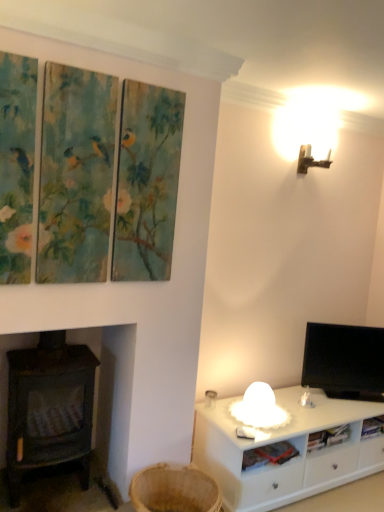
Question: Can you confirm if black glossy tv at right is bigger than dark brown wood burning stove at left?

Choices:
 (A) no
 (B) yes

Answer: (A)

Question: Considering the relative positions of black glossy tv at right and dark brown wood burning stove at left in the image provided, is black glossy tv at right to the right of dark brown wood burning stove at left from the viewer's perspective?

Choices:
 (A) yes
 (B) no

Answer: (A)

Question: Is black glossy tv at right taller than dark brown wood burning stove at left?

Choices:
 (A) no
 (B) yes

Answer: (A)

Question: Is black glossy tv at right thinner than dark brown wood burning stove at left?

Choices:
 (A) no
 (B) yes

Answer: (B)

Question: Can you confirm if black glossy tv at right is wider than dark brown wood burning stove at left?

Choices:
 (A) yes
 (B) no

Answer: (B)

Question: Is point pos(309,162) closer or farther from the camera than point pos(365,393)?

Choices:
 (A) closer
 (B) farther

Answer: (A)

Question: Looking at the image, does metallic wall sconce at upper right seem bigger or smaller compared to black glossy tv at right?

Choices:
 (A) big
 (B) small

Answer: (B)

Question: Is metallic wall sconce at upper right in front of or behind black glossy tv at right in the image?

Choices:
 (A) behind
 (B) front

Answer: (B)

Question: From a real-world perspective, is metallic wall sconce at upper right positioned above or below black glossy tv at right?

Choices:
 (A) above
 (B) below

Answer: (A)

Question: From a real-world perspective, relative to dark brown wood burning stove at left, is black glossy tv at right vertically above or below?

Choices:
 (A) below
 (B) above

Answer: (B)

Question: From the image's perspective, is black glossy tv at right above or below dark brown wood burning stove at left?

Choices:
 (A) below
 (B) above

Answer: (B)

Question: Is black glossy tv at right taller or shorter than dark brown wood burning stove at left?

Choices:
 (A) short
 (B) tall

Answer: (A)

Question: Considering the positions of black glossy tv at right and dark brown wood burning stove at left in the image, is black glossy tv at right wider or thinner than dark brown wood burning stove at left?

Choices:
 (A) thin
 (B) wide

Answer: (A)

Question: Does point (14, 343) appear closer or farther from the camera than point (311, 336)?

Choices:
 (A) closer
 (B) farther

Answer: (A)

Question: Would you say dark brown wood burning stove at left is inside or outside black glossy tv at right?

Choices:
 (A) outside
 (B) inside

Answer: (A)